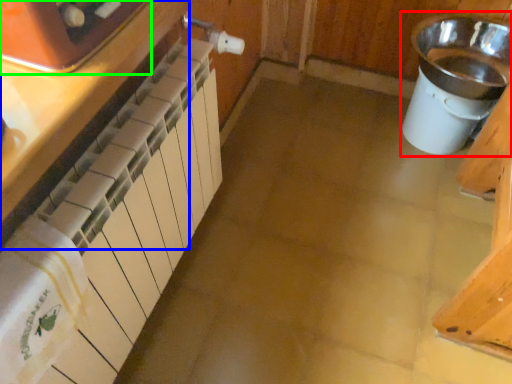
Question: Estimate the real-world distances between objects in this image. Which object is closer to sink (highlighted by a red box), cabinetry (highlighted by a blue box) or home appliance (highlighted by a green box)?

Choices:
 (A) cabinetry
 (B) home appliance

Answer: (A)